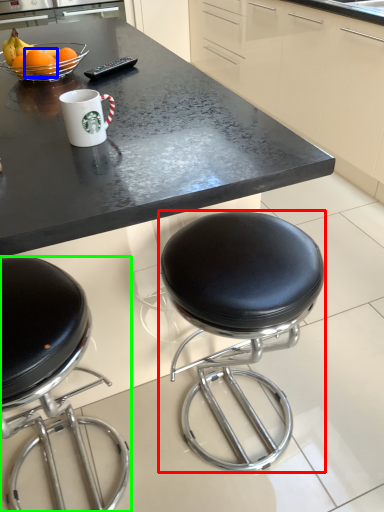
Question: Which object is positioned farthest from stool (highlighted by a red box)? Select from orange (highlighted by a blue box) and chair (highlighted by a green box).

Choices:
 (A) orange
 (B) chair

Answer: (A)